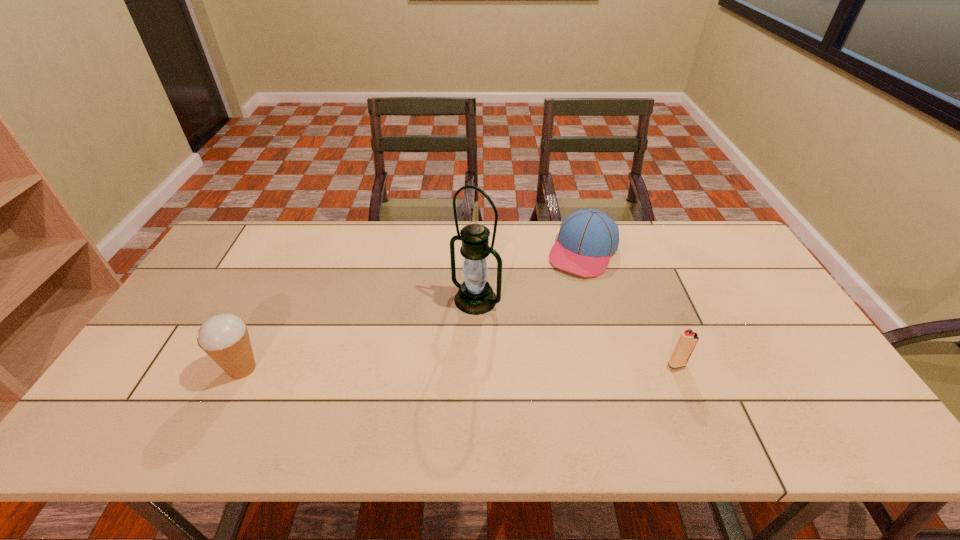
This screenshot has height=540, width=960. I want to click on vacant spot on the desktop that is between the second tallest object and the rightmost object and is positioned on the front-facing side of the farthest object, so tap(517, 366).

The image size is (960, 540). I want to click on vacant spot on the desktop that is between the third shortest object and the rightmost object and is positioned on the side where the third nearest object emits light, so click(x=413, y=367).